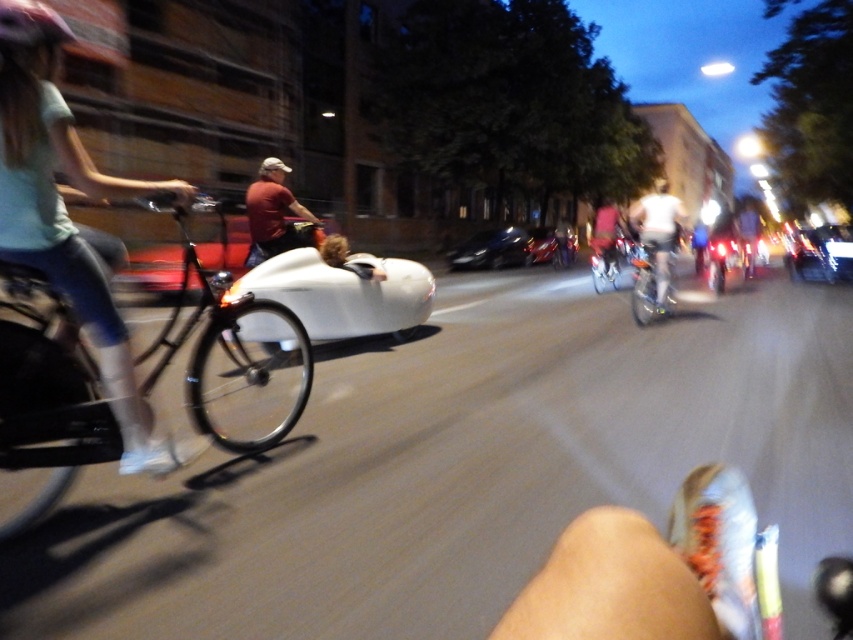
You are standing on the sidewalk and see the matte teal shirt at left and the shiny silver bicycle at center. Which object is taller from your viewpoint?

The matte teal shirt at left is much taller than the shiny silver bicycle at center from your viewpoint.

In the scene shown: You are a pedestrian standing on the sidewalk and see a white matte bicycle at center and a matte red shirt at center in the street. Which object is closer to you?

The white matte bicycle at center is closer to you because it is further to the viewer than the matte red shirt at center.

You are a pedestrian standing on the sidewalk and see the matte teal shirt at left and the shiny silver bicycle at center. Which object is closer to the ground?

The matte teal shirt at left is below shiny silver bicycle at center, so it is closer to the ground.